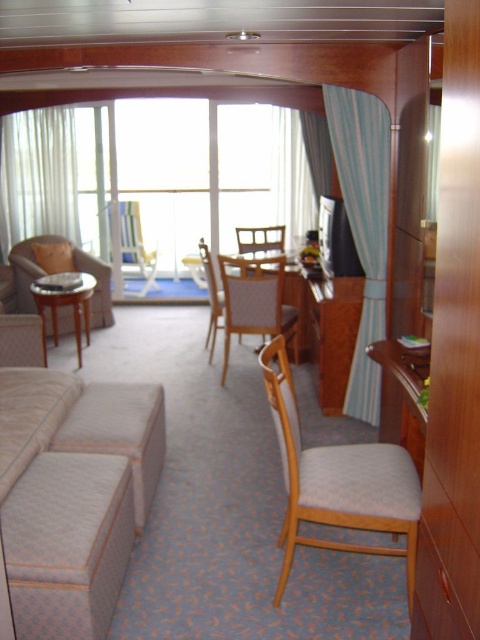
Is blue striped curtain at right above light gray fabric chair at center?

Yes.

Which is in front, point (335, 154) or point (240, 259)?

Point (335, 154)

Where is `blue striped curtain at right`? The height and width of the screenshot is (640, 480). blue striped curtain at right is located at coordinates (363, 225).

Is white sheer curtains at left smaller than blue striped curtain at right?

Actually, white sheer curtains at left might be larger than blue striped curtain at right.

Can you confirm if white sheer curtains at left is positioned below blue striped curtain at right?

No.

Is point (153, 104) more distant than point (374, 337)?

That is True.

Image resolution: width=480 pixels, height=640 pixels. Identify the location of white sheer curtains at left. (156, 182).

Is point (375, 212) positioned before point (313, 152)?

Yes, it is.

Who is lower down, blue striped curtain at right or blue striped curtain at upper center?

blue striped curtain at right

Is point (388, 125) behind point (320, 177)?

No, (388, 125) is in front of (320, 177).

The image size is (480, 640). I want to click on blue striped curtain at right, so click(x=363, y=225).